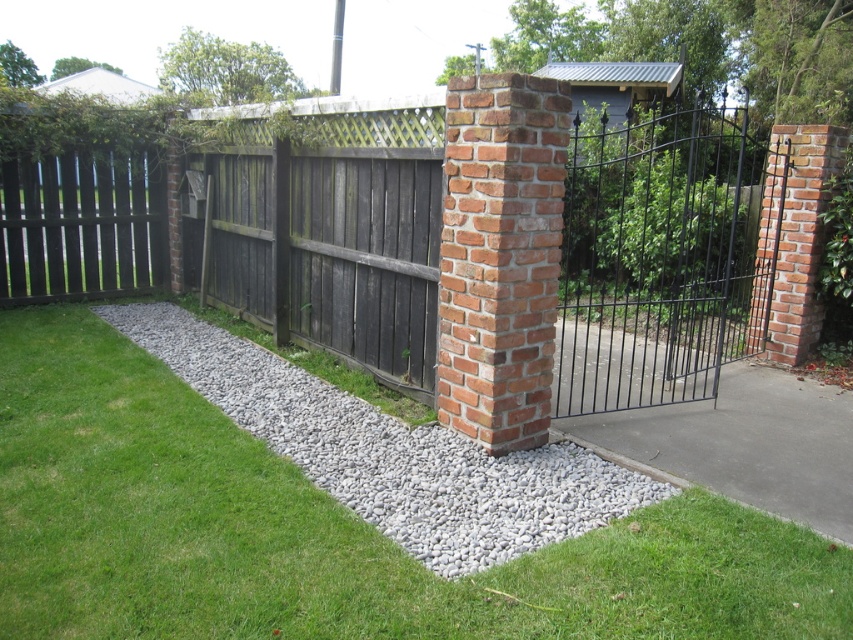
You are a delivery person with a cart that is 8 feet wide. You need to pass through the entrance area shown in the image. Can your cart fit through the space between the wooden fence at center and the gray gravel at center?

The wooden fence at center and gray gravel at center are 7.73 feet apart. Since your cart is 8 feet wide, it cannot fit through the space between them.

You are a landscape designer assessing the entrance area. You need to install a new light fixture that requires a mounting height of at least 1.5 meters. Which object between the gray gravel at center and the red brick column at center would be suitable for installation?

The red brick column at center is taller than the gray gravel at center, so the red brick column at center would be suitable for mounting the light fixture as it meets the required height of 1.5 meters.